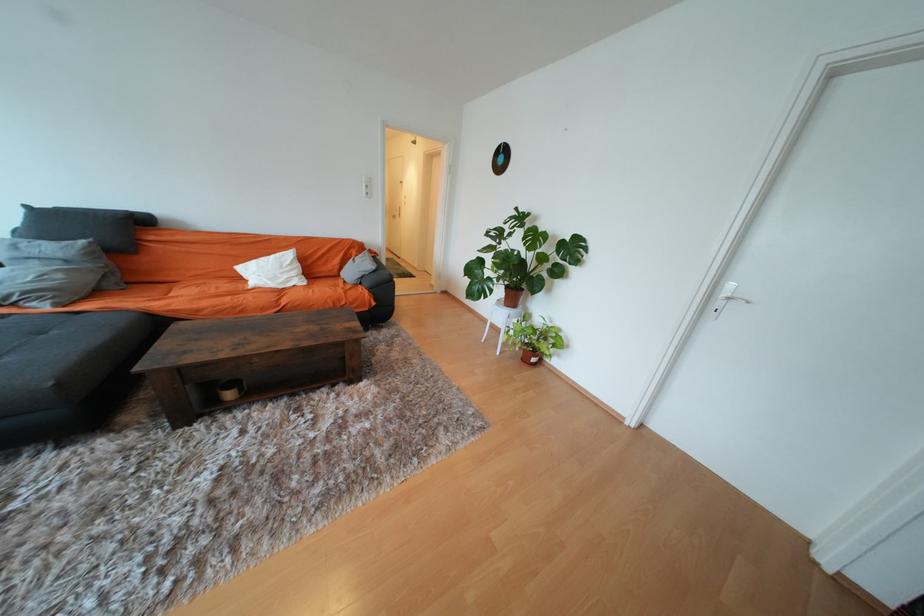
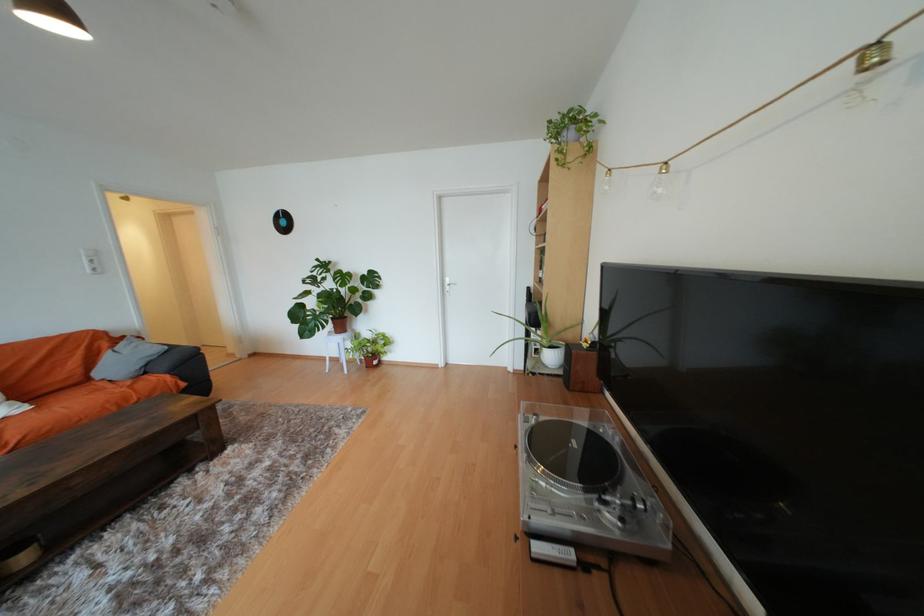
Question: The camera is either moving clockwise (left) or counter-clockwise (right) around the object. The first image is from the beginning of the video and the second image is from the end. Is the camera moving left or right when shooting the video?

Choices:
 (A) Left
 (B) Right

Answer: (A)